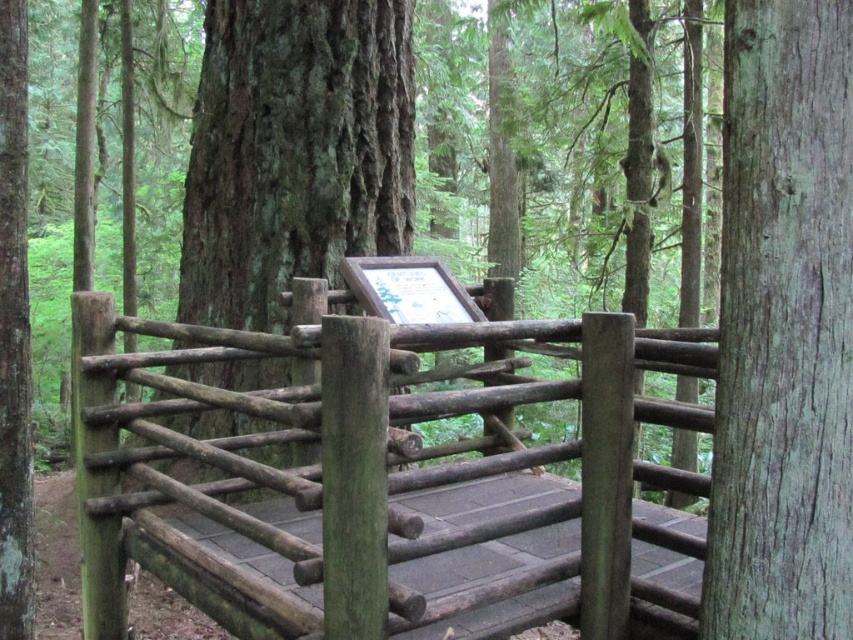
Question: Which object is the farthest from the green rough bark tree at left?

Choices:
 (A) green rough bark tree at center
 (B) green wood fence at center

Answer: (A)

Question: Considering the relative positions of green wood fence at center and green rough bark tree at left in the image provided, where is green wood fence at center located with respect to green rough bark tree at left?

Choices:
 (A) below
 (B) above

Answer: (A)

Question: Can you confirm if green wood fence at center is positioned above gray rough wood at right?

Choices:
 (A) yes
 (B) no

Answer: (B)

Question: Estimate the real-world distances between objects in this image. Which object is farther from the green wood fence at center?

Choices:
 (A) green rough bark tree at center
 (B) green rough bark tree at left

Answer: (A)

Question: Is green wood fence at center behind green rough bark tree at left?

Choices:
 (A) yes
 (B) no

Answer: (B)

Question: Which object is positioned closest to the green rough bark tree at left?

Choices:
 (A) green wood fence at center
 (B) gray rough wood at right
 (C) green rough bark tree at center

Answer: (A)